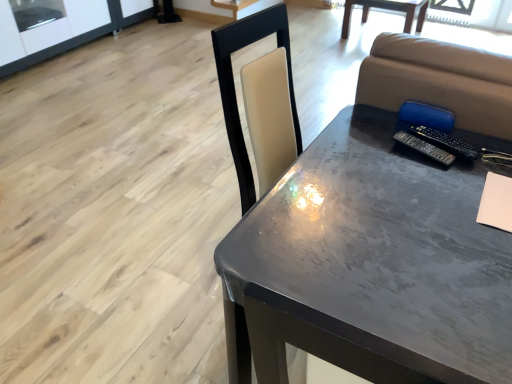
Find the location of a particular element. The image size is (512, 384). free space to the left of blue fabric armchair at upper right is located at coordinates 371,130.